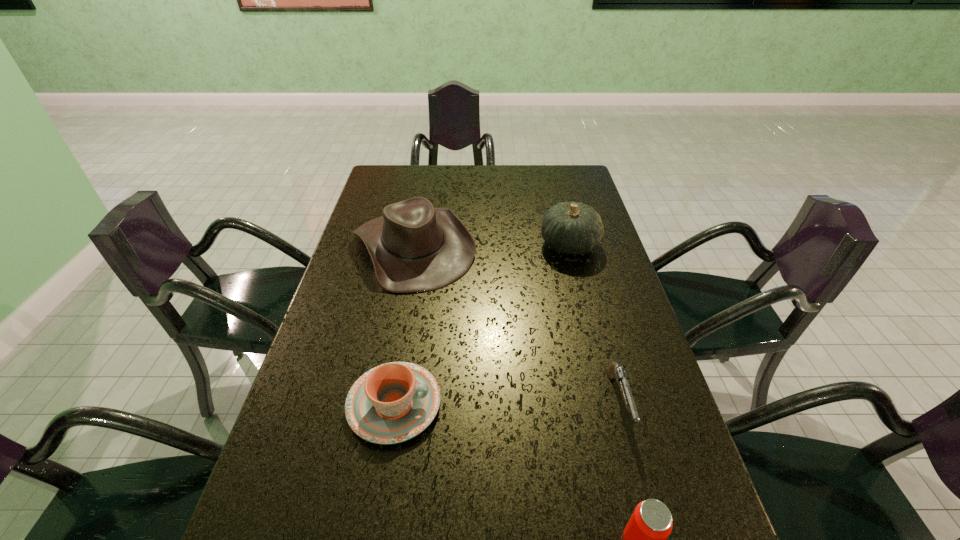
Locate an element on the screen. gourd is located at coordinates (574, 228).

Locate an element on the screen. This screenshot has height=540, width=960. cowboy hat is located at coordinates [x=414, y=247].

Locate an element on the screen. chinaware is located at coordinates (394, 402).

At what (x,y) coordinates should I click in order to perform the action: click on gun. Please return your answer as a coordinate pair (x, y). Looking at the image, I should click on (614, 371).

Find the location of a particular element. This screenshot has height=540, width=960. free space located on the front of the gourd is located at coordinates click(x=590, y=327).

Identify the location of blank space located on the front of the cowboy hat. The image size is (960, 540). (383, 415).

This screenshot has height=540, width=960. In order to click on vacant point located on the handle side of the chinaware in this screenshot , I will do `click(560, 404)`.

You are a GUI agent. You are given a task and a screenshot of the screen. Output one action in this format:
    pyautogui.click(x=<x>, y=<y>)
    Task: Click on the vacant space located 0.120m aiming along the barrel of the gun
    The height and width of the screenshot is (540, 960).
    Given the screenshot: What is the action you would take?
    pyautogui.click(x=646, y=503)

The width and height of the screenshot is (960, 540). I want to click on cowboy hat that is at the left edge, so click(x=414, y=247).

Identify the location of chinaware that is at the left edge. (394, 402).